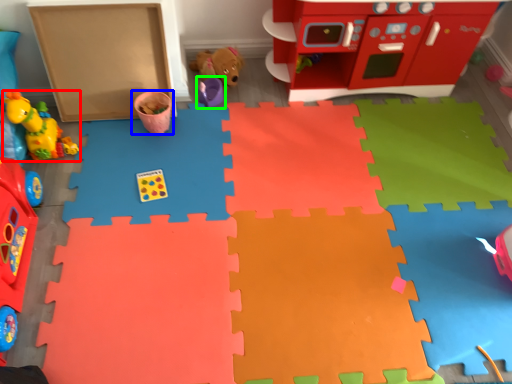
Question: Based on their relative distances, which object is nearer to toy (highlighted by a red box)? Choose from toy (highlighted by a blue box) and toy (highlighted by a green box).

Choices:
 (A) toy
 (B) toy

Answer: (A)